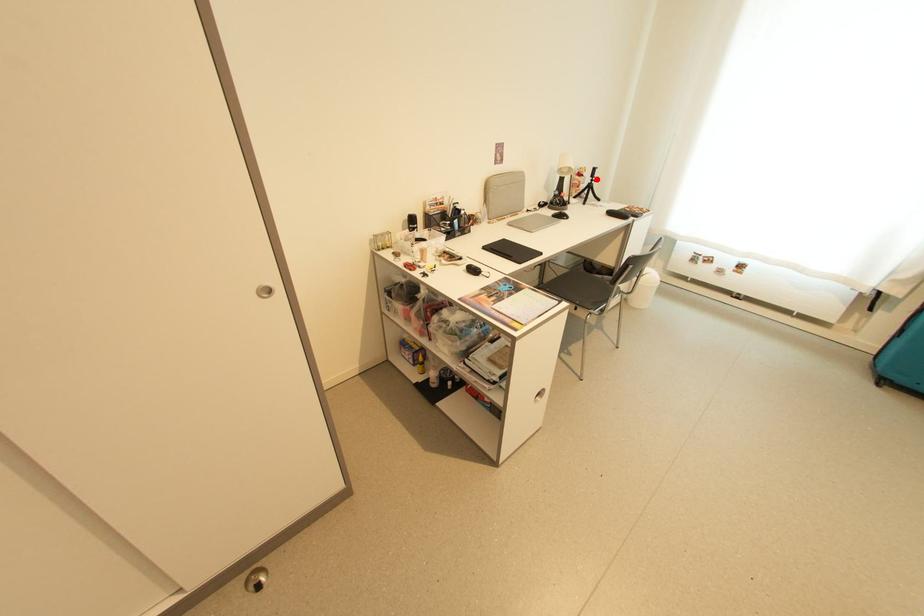
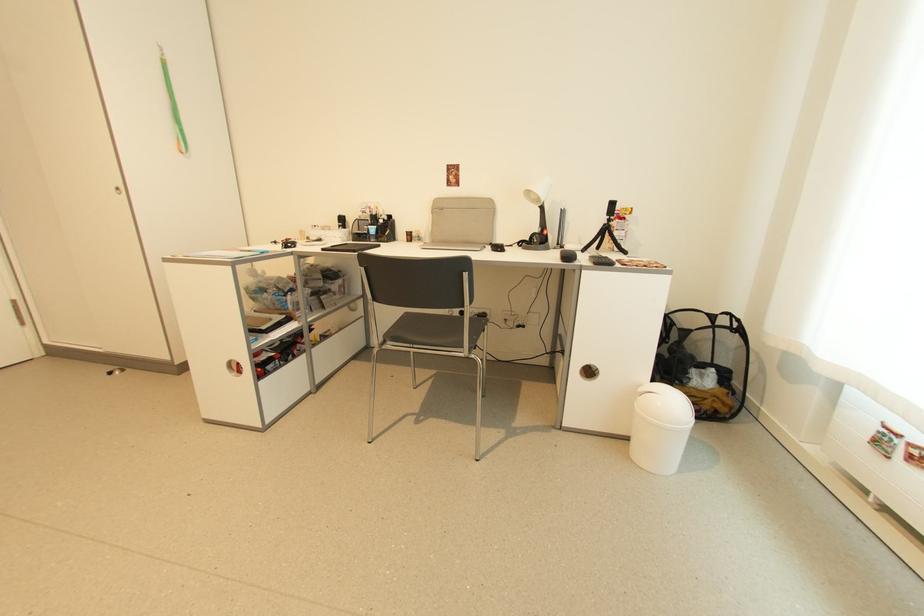
Where in the second image is the point corresponding to the highlighted location from the first image?

(612, 217)